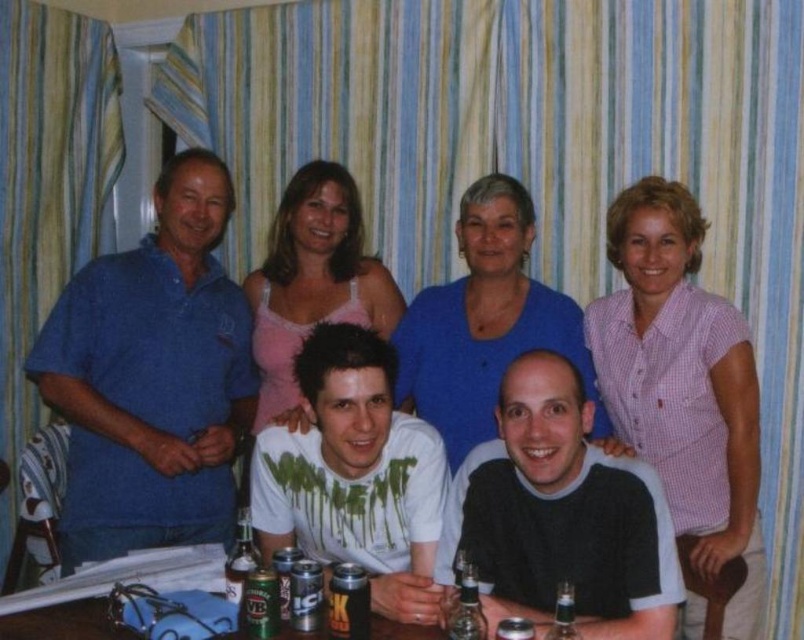
You are organizing a small party and need to arrange drinks on a narrow shelf. You have a translucent plastic bottle at lower center and a green matte beer can at center. Which one can fit better in a space that is only wide enough for the narrower item?

The translucent plastic bottle at lower center can fit better because its width is less than the green matte beer can at center.

You are a photographer trying to adjust the lighting for a group photo. You notice two people wearing a dark gray sweater at center and a white matte shirt at center. Since the distance between them is 10.49 inches, can you estimate if they are standing close enough to ensure both are well lit by a single spotlight placed between them?

The distance between the dark gray sweater at center and the white matte shirt at center is 10.49 inches, which is relatively close. A single spotlight placed between them should adequately illuminate both individuals as they are within a reasonable proximity.

You are standing in the room where the photo was taken. You want to find the exact location of the point with coordinates (560, 515). Which object in the scene is this point located on?

The point with coordinates (560, 515) is located on the dark gray sweater at center.